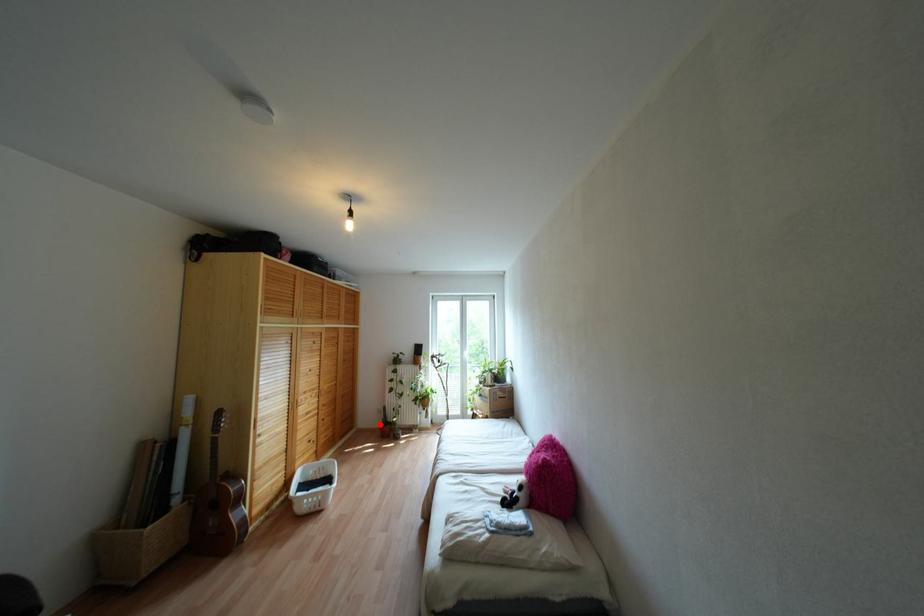
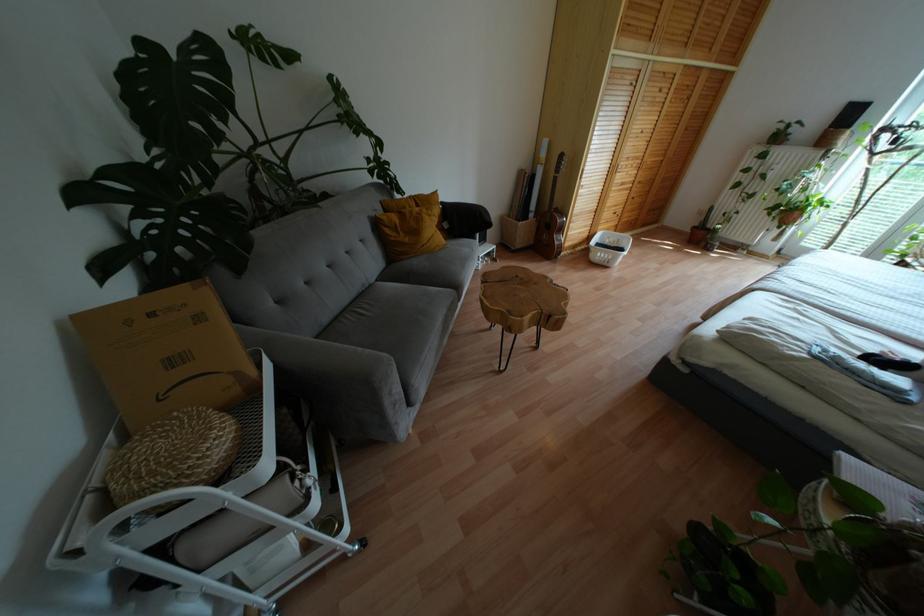
Question: I am providing you with two images of the same scene from different viewpoints. Given a red point in image1, look at the same physical point in image2. Is it:

Choices:
 (A) Closer to the viewpoint
 (B) Farther from the viewpoint

Answer: (A)